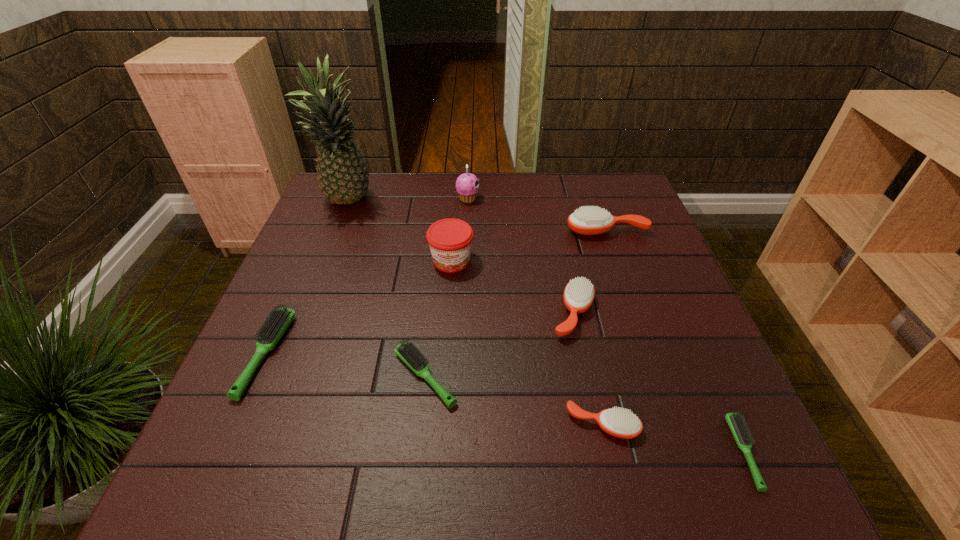
At what (x,y) coordinates should I click in order to perform the action: click on vacant point located between the smallest orange hairbrush and the eighth shortest object. Please return your answer as a coordinate pair (x, y). This screenshot has height=540, width=960. Looking at the image, I should click on (535, 312).

Find the location of `vacant space that's between the farthest orange hairbrush and the biggest light hairbrush`. vacant space that's between the farthest orange hairbrush and the biggest light hairbrush is located at coordinates (437, 292).

Find the location of a particular element. The height and width of the screenshot is (540, 960). vacant point located between the fifth tallest hairbrush and the smallest orange hairbrush is located at coordinates (514, 401).

I want to click on free spot between the nearest orange hairbrush and the seventh nearest object, so click(x=605, y=327).

In order to click on empty location between the pineapple and the second tallest object in this screenshot , I will do `click(408, 200)`.

At what (x,y) coordinates should I click in order to perform the action: click on free area in between the second light hairbrush from left to right and the nearest orange hairbrush. Please return your answer as a coordinate pair (x, y). The height and width of the screenshot is (540, 960). Looking at the image, I should click on (514, 401).

Locate which object is the fourth closest to the jam. Please provide its 2D coordinates. Your answer should be formatted as a tuple, i.e. [(x, y)], where the tuple contains the x and y coordinates of a point satisfying the conditions above.

[(406, 351)]

Where is `object that stands as the closest to the cupcake`? This screenshot has width=960, height=540. object that stands as the closest to the cupcake is located at coordinates tap(450, 240).

Select which hairbrush is the closest to the sixth nearest object. Please provide its 2D coordinates. Your answer should be formatted as a tuple, i.e. [(x, y)], where the tuple contains the x and y coordinates of a point satisfying the conditions above.

[(579, 294)]

I want to click on hairbrush that stands as the fourth closest to the seventh nearest object, so click(735, 421).